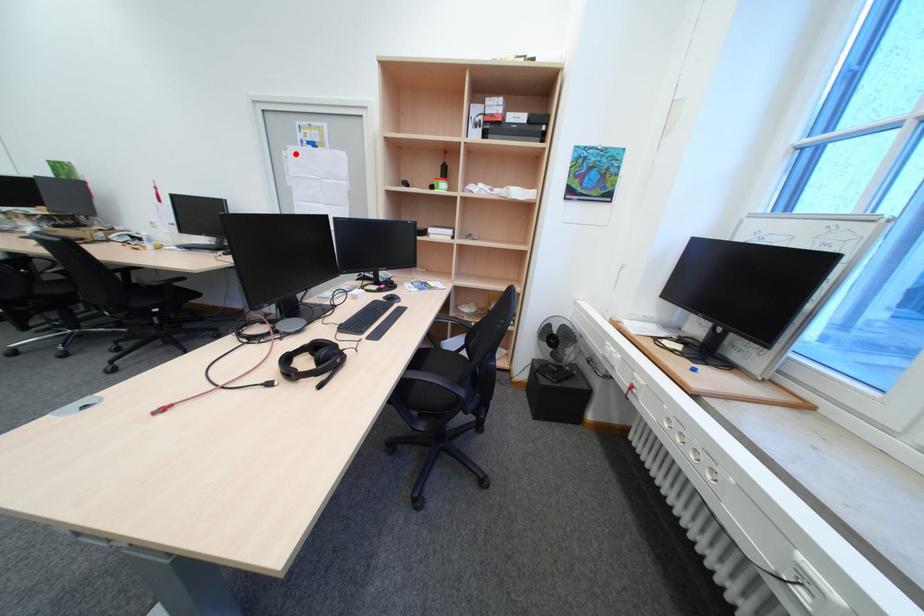
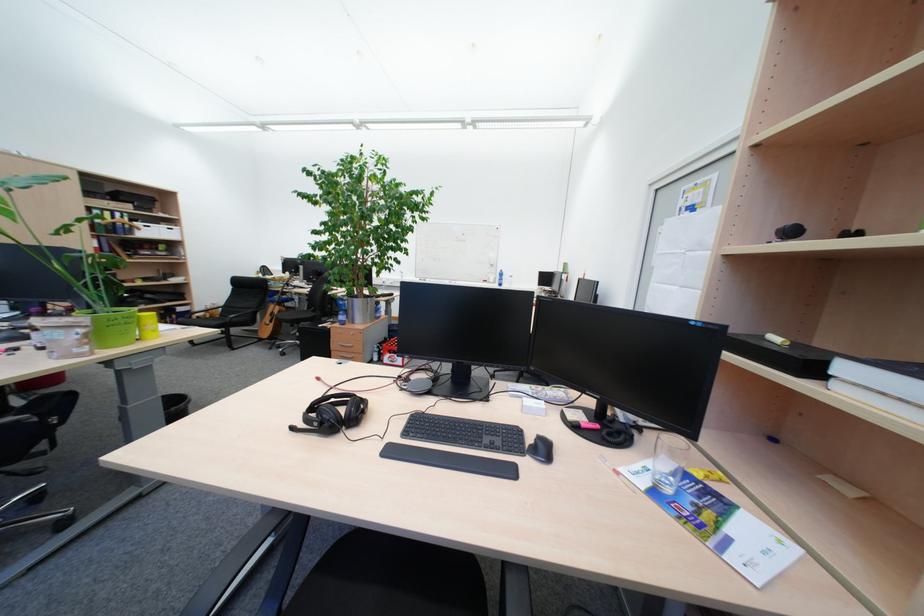
In the second image, find the point that corresponds to the highlighted location in the first image.

(671, 230)